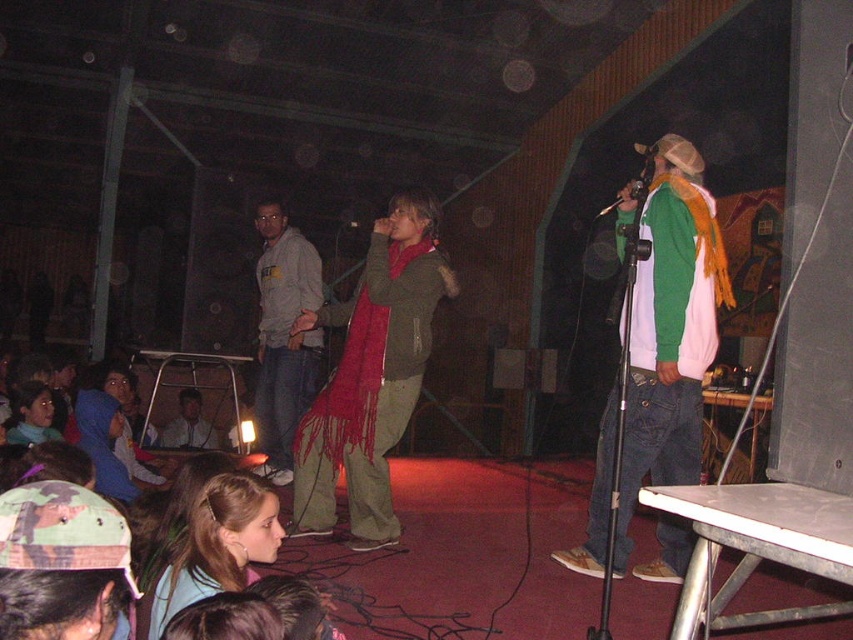
You are a stagehand preparing to adjust the lighting for the performers. You notice the matte red scarf at center and the blue denim jacket at lower left. Which object is positioned higher in the scene?

The matte red scarf at center is much taller than the blue denim jacket at lower left, so it is positioned higher in the scene.

You are an event organizer trying to set up a new speaker stand in the middle of the stage. The stage has two existing points marked at coordinates point [395,248] and point [148,476]. Which of these points is closer to the front of the stage where the audience is seated?

Point [395,248] is closer to the viewer than point [148,476], so the point [395,248] is closer to the front of the stage where the audience is seated.

You are a photographer at the event and need to adjust your camera focus. Which object, the blonde hair at lower left or the blue denim jacket at lower left, should you focus on first if you want to capture the smaller one?

The blonde hair at lower left should be focused on first because it has a smaller size compared to the blue denim jacket at lower left.